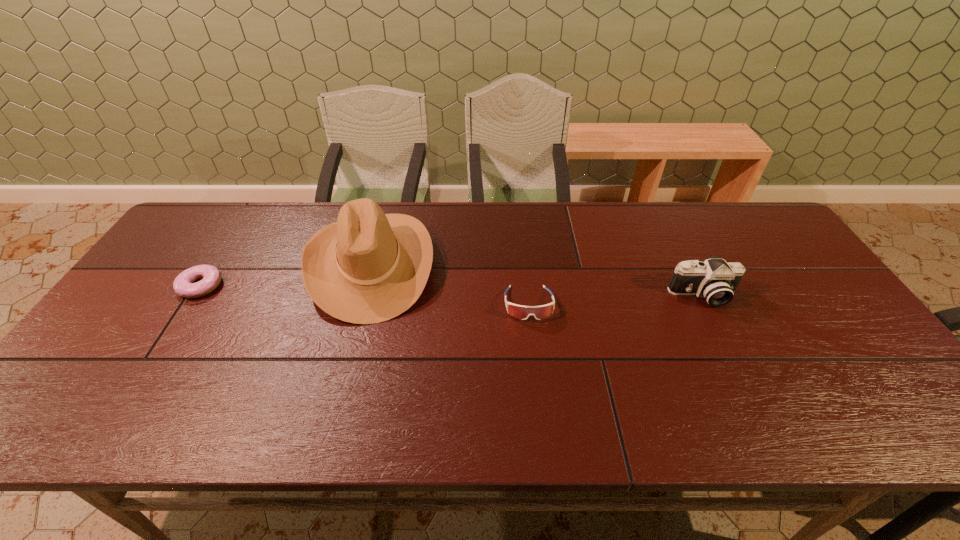
What are the coordinates of `the third object from right to left` in the screenshot? It's located at (368, 267).

The width and height of the screenshot is (960, 540). Identify the location of cowboy hat. (368, 267).

Where is `the second tallest object`? The height and width of the screenshot is (540, 960). the second tallest object is located at coordinates pyautogui.click(x=715, y=279).

Identify the location of the rightmost object. click(x=715, y=279).

Image resolution: width=960 pixels, height=540 pixels. What are the coordinates of `the third object from left to right` in the screenshot? It's located at (521, 312).

I want to click on the second shortest object, so click(x=521, y=312).

Where is `the leftmost object`? The image size is (960, 540). the leftmost object is located at coordinates (184, 286).

Identify the location of doughnut. The image size is (960, 540). (184, 286).

Locate an element on the screen. The height and width of the screenshot is (540, 960). free space located on the left of the tallest object is located at coordinates (185, 264).

Identify the location of free space located on the back of the camera. Image resolution: width=960 pixels, height=540 pixels. (668, 226).